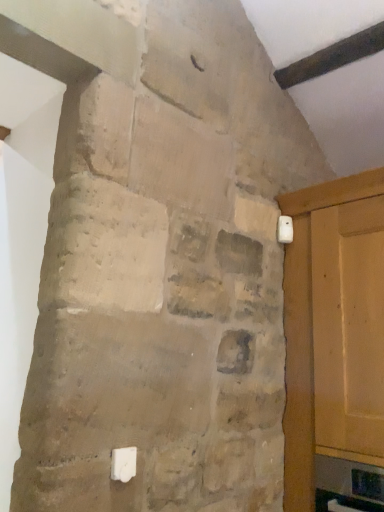
Question: Is matte wood door at right wider than white plastic light switch at lower center, arranged as the 1th light switch when viewed from the left?

Choices:
 (A) yes
 (B) no

Answer: (A)

Question: Does matte wood door at right turn towards white plastic light switch at lower center, the second light switch in the right-to-left sequence?

Choices:
 (A) no
 (B) yes

Answer: (B)

Question: Could white plastic light switch at lower center, the first light switch in the bottom-to-top sequence, be considered to be inside matte wood door at right?

Choices:
 (A) no
 (B) yes

Answer: (A)

Question: From a real-world perspective, is matte wood door at right under white plastic light switch at lower center, the 1th light switch in the front-to-back sequence?

Choices:
 (A) no
 (B) yes

Answer: (A)

Question: Would you say matte wood door at right is a long distance from white plastic light switch at lower center, arranged as the 1th light switch when viewed from the left?

Choices:
 (A) no
 (B) yes

Answer: (A)

Question: Is matte wood door at right smaller than white plastic light switch at lower center, arranged as the 1th light switch when viewed from the left?

Choices:
 (A) no
 (B) yes

Answer: (A)

Question: From a real-world perspective, does matte wood door at right sit lower than white plastic light switch at upper right, the 2th light switch positioned from the bottom?

Choices:
 (A) no
 (B) yes

Answer: (B)

Question: Can you confirm if matte wood door at right is wider than white plastic light switch at upper right, the 2th light switch in the left-to-right sequence?

Choices:
 (A) yes
 (B) no

Answer: (A)

Question: Does matte wood door at right appear on the left side of white plastic light switch at upper right, the 2th light switch positioned from the bottom?

Choices:
 (A) no
 (B) yes

Answer: (A)

Question: Is matte wood door at right positioned before white plastic light switch at upper right, positioned as the first light switch in right-to-left order?

Choices:
 (A) no
 (B) yes

Answer: (B)

Question: Does matte wood door at right have a larger size compared to white plastic light switch at upper right, the 2th light switch in the left-to-right sequence?

Choices:
 (A) no
 (B) yes

Answer: (B)

Question: From the image's perspective, would you say matte wood door at right is shown under white plastic light switch at upper right, the 2th light switch positioned from the bottom?

Choices:
 (A) no
 (B) yes

Answer: (B)

Question: Considering the relative sizes of white plastic light switch at upper right, the 2th light switch in the left-to-right sequence, and white plastic light switch at lower center, the 2th light switch from the back, in the image provided, is white plastic light switch at upper right, the 2th light switch in the left-to-right sequence, bigger than white plastic light switch at lower center, the 2th light switch from the back,?

Choices:
 (A) no
 (B) yes

Answer: (B)